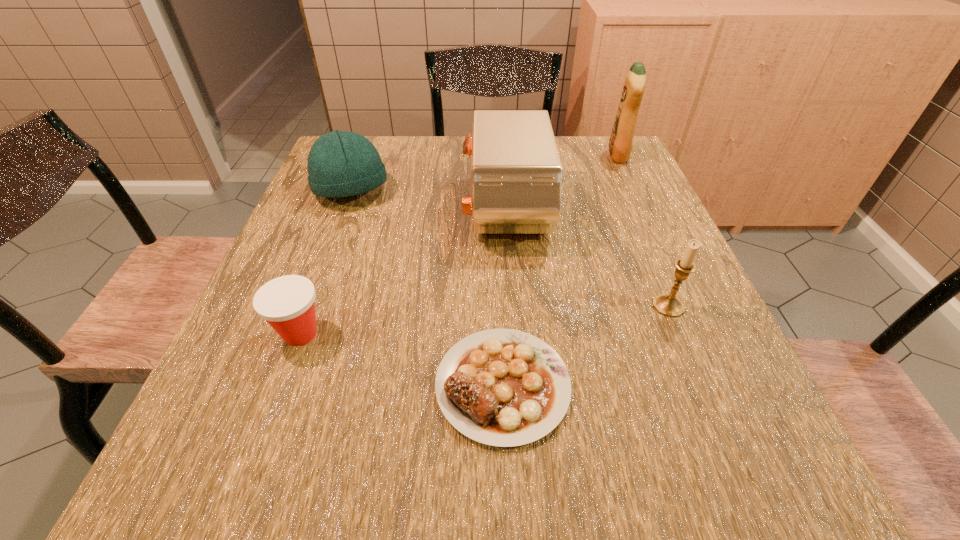
Locate an element on the screen. The image size is (960, 540). object at the near edge is located at coordinates (501, 387).

Where is `beanie at the left edge`? This screenshot has width=960, height=540. beanie at the left edge is located at coordinates (340, 163).

I want to click on Dixie cup that is positioned at the left edge, so click(x=287, y=303).

This screenshot has height=540, width=960. What are the coordinates of `detergent situated at the right edge` in the screenshot? It's located at (621, 141).

Locate an element on the screen. candle holder that is at the right edge is located at coordinates (668, 304).

The width and height of the screenshot is (960, 540). I want to click on object that is positioned at the far left corner, so click(x=340, y=163).

The image size is (960, 540). Identify the location of object that is at the far right corner. (621, 141).

This screenshot has width=960, height=540. In the image, there is a desktop. Identify the location of free region at the far edge. (460, 136).

The image size is (960, 540). Find the location of `free space at the near edge`. free space at the near edge is located at coordinates (407, 481).

Where is `free region at the left edge of the desktop`? The height and width of the screenshot is (540, 960). free region at the left edge of the desktop is located at coordinates click(x=334, y=229).